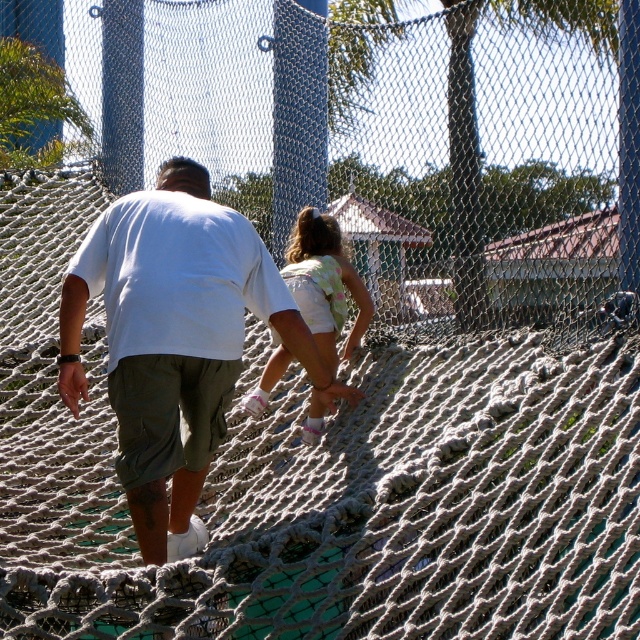
Question: Is white cotton shirt at center above light pink fabric dress at center?

Choices:
 (A) no
 (B) yes

Answer: (A)

Question: Can you confirm if white cotton shirt at center is positioned below light pink fabric dress at center?

Choices:
 (A) yes
 (B) no

Answer: (A)

Question: Which of the following is the farthest from the observer?

Choices:
 (A) (138, 301)
 (B) (310, 294)

Answer: (B)

Question: Can you confirm if white cotton shirt at center is thinner than light pink fabric dress at center?

Choices:
 (A) yes
 (B) no

Answer: (B)